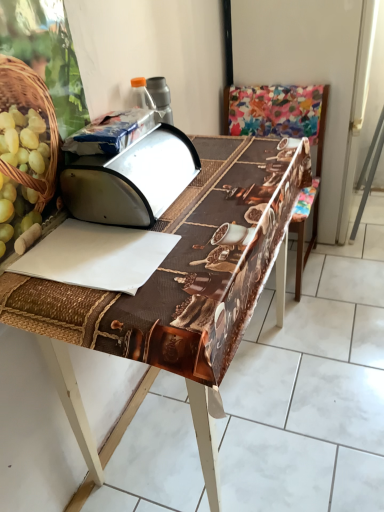
Question: Considering the positions of brown woven table at center and blue plastic bag at upper center, positioned as the 2th wrapping paper in bottom-to-top order, in the image, is brown woven table at center bigger or smaller than blue plastic bag at upper center, positioned as the 2th wrapping paper in bottom-to-top order,?

Choices:
 (A) small
 (B) big

Answer: (B)

Question: Considering the positions of brown woven table at center and blue plastic bag at upper center, which is the 1th wrapping paper in top-to-bottom order, in the image, is brown woven table at center wider or thinner than blue plastic bag at upper center, which is the 1th wrapping paper in top-to-bottom order,?

Choices:
 (A) thin
 (B) wide

Answer: (B)

Question: Which object is the farthest from the blue plastic bag at upper center, which is the 1th wrapping paper in top-to-bottom order?

Choices:
 (A) metallic silver breadbox at center
 (B) brown woven table at center
 (C) multicolored fabric chair at center
 (D) white paper at center, the first wrapping paper in the bottom-to-top sequence

Answer: (C)

Question: Which is farther from the brown woven table at center?

Choices:
 (A) blue plastic bag at upper center, positioned as the 2th wrapping paper in bottom-to-top order
 (B) multicolored fabric chair at center
 (C) metallic silver breadbox at center
 (D) white paper at center, which ranks as the second wrapping paper in top-to-bottom order

Answer: (B)